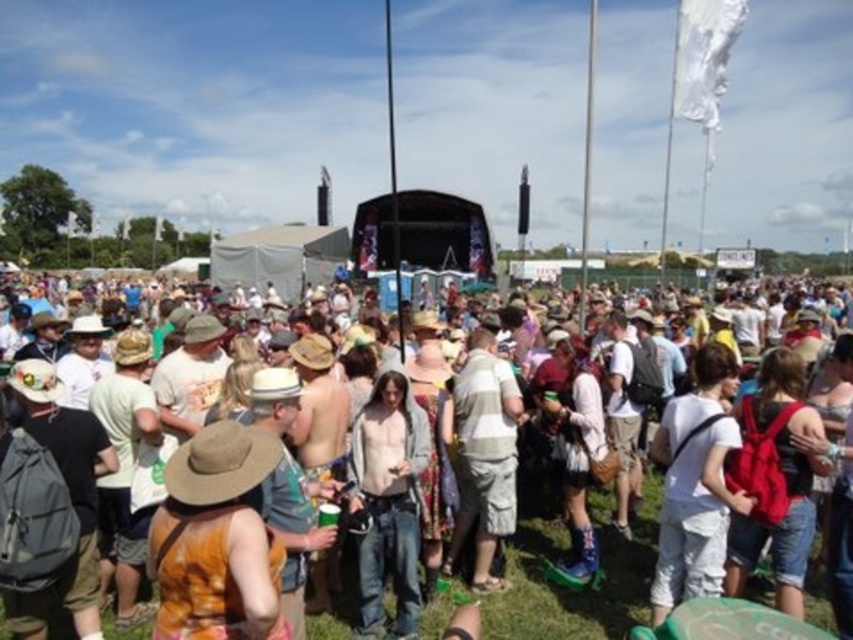
You are a festival attendee who wants to take a photo of the stage. You notice the matte white tent at center and the brown straw cowboy hat at center are blocking your view. Which object is taller and would block your view more?

The matte white tent at center is taller than the brown straw cowboy hat at center, so it would block your view more.

You are a festival attendee trying to get to the stage. You see the matte white tent at center and the brown straw cowboy hat at center. Which object is closer to you?

The matte white tent at center is closer to you than the brown straw cowboy hat at center because it is further to the viewer.